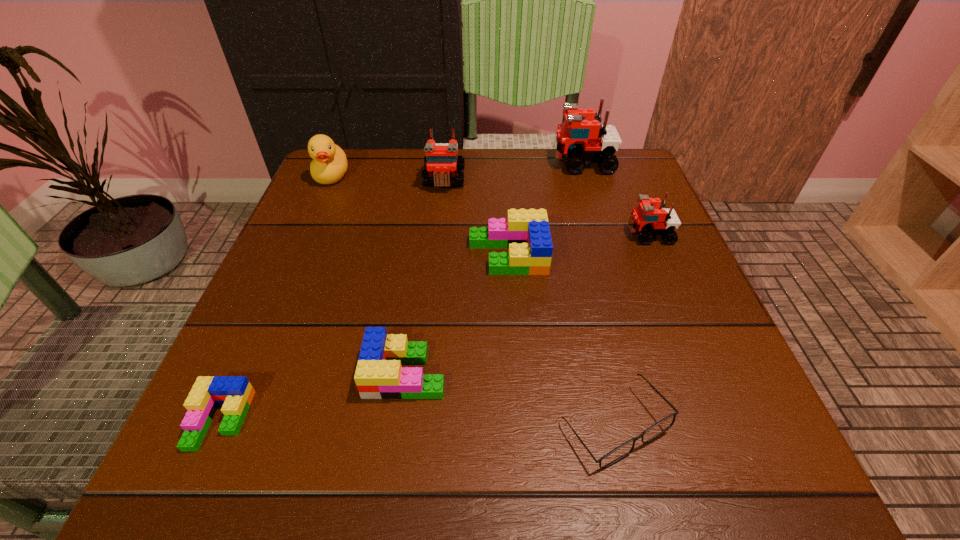
This screenshot has height=540, width=960. In order to click on the second biggest green Lego in this screenshot , I will do `click(379, 375)`.

The width and height of the screenshot is (960, 540). I want to click on spectacles, so click(x=620, y=452).

Where is `the leftmost green Lego`? The height and width of the screenshot is (540, 960). the leftmost green Lego is located at coordinates (235, 393).

Locate an element on the screen. The height and width of the screenshot is (540, 960). the smallest green Lego is located at coordinates (235, 393).

This screenshot has height=540, width=960. I want to click on vacant space located 0.210m on the front-facing side of the tallest object, so coord(469,163).

The height and width of the screenshot is (540, 960). I want to click on blank space located 0.170m on the front-facing side of the tallest object, so click(x=486, y=163).

Find the location of `free spot located 0.320m on the front-facing side of the tallest object`. free spot located 0.320m on the front-facing side of the tallest object is located at coordinates (426, 163).

The width and height of the screenshot is (960, 540). Find the location of `vacant space located 0.290m on the front-facing side of the second smallest red Lego`. vacant space located 0.290m on the front-facing side of the second smallest red Lego is located at coordinates (433, 284).

At what (x,y) coordinates should I click in order to perform the action: click on vacant space situated at the beak of the yellow duck. Please return your answer as a coordinate pair (x, y). This screenshot has height=540, width=960. Looking at the image, I should click on (292, 267).

This screenshot has width=960, height=540. I want to click on vacant space positioned on the front-facing side of the fourth tallest object, so click(536, 234).